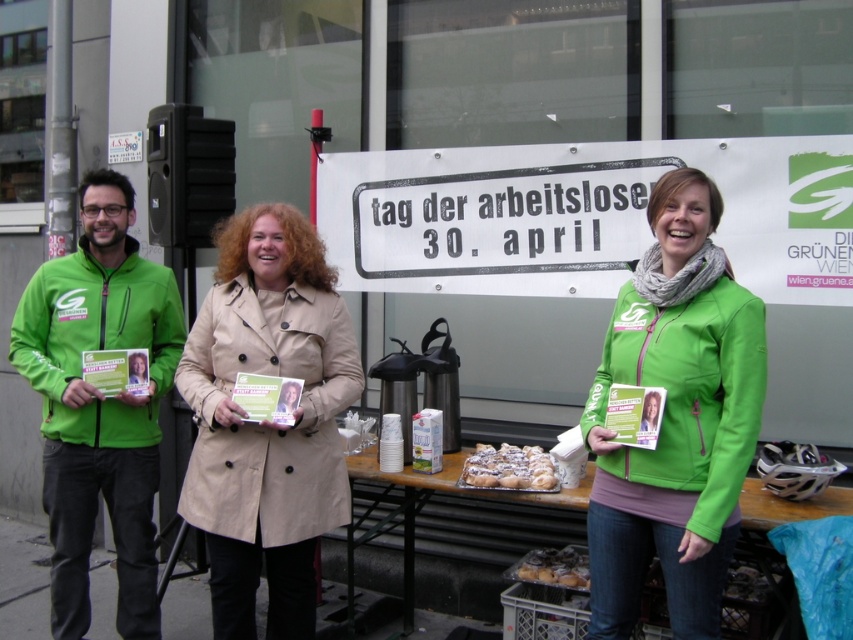
From the picture: You are a photographer at the event and need to capture a photo of the beige trench coat at center and the green fleece jacket at left. The camera has a minimum focus distance of 25 inches. Can you take a clear photo of both without moving them?

The beige trench coat at center is 24.97 inches from the green fleece jacket at left, which is just below the camera minimum focus distance of 25 inches. Therefore, the camera may not be able to focus on both subjects clearly without moving them closer together.

You are standing in front of the large banner for the Day of the Unemployed event. You see a point marked at coordinates (99, 403). Which object from the scene does this point correspond to?

The point at coordinates (99, 403) corresponds to the green fleece jacket at left.

You are attending an outdoor event and notice two people wearing jackets at the center of the scene. Which jacket is smaller in size between the green softshell jacket at center and the beige trench coat at center?

The green softshell jacket at center is smaller than the beige trench coat at center according to the description.